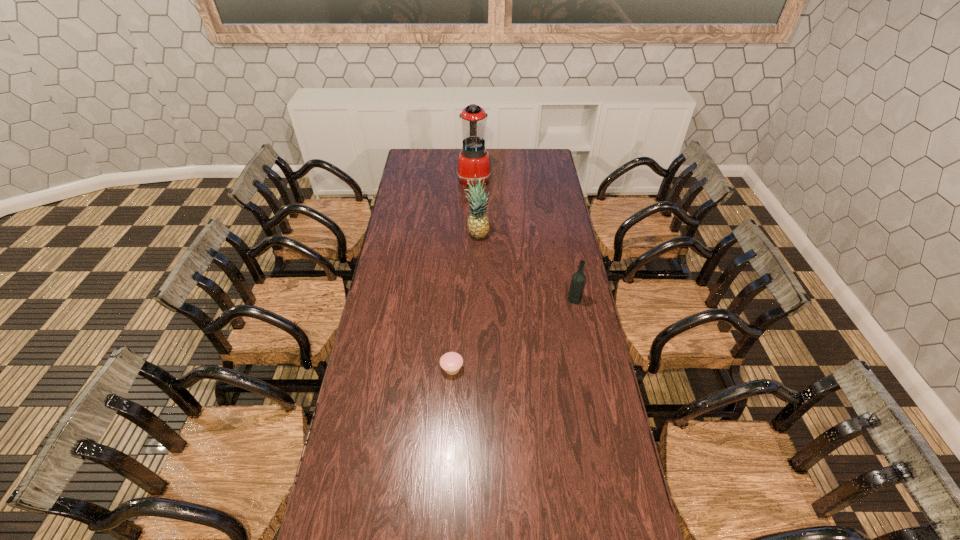
In order to click on vacant space that's between the shortest object and the tallest object in this screenshot , I will do `click(463, 273)`.

Where is `vacant space that's between the vodka and the cupcake`? vacant space that's between the vodka and the cupcake is located at coordinates (514, 334).

The image size is (960, 540). I want to click on object that stands as the second closest to the tallest object, so click(578, 280).

The image size is (960, 540). What are the coordinates of `object that can be found as the second closest to the shortest object` in the screenshot? It's located at (478, 224).

Identify the location of free location that satisfies the following two spatial constraints: 1. on the controls of the food processor; 2. on the back side of the rightmost object. (472, 299).

Locate an element on the screen. vacant region that satisfies the following two spatial constraints: 1. on the controls of the third farthest object; 2. on the right side of the food processor is located at coordinates (472, 299).

I want to click on free location that satisfies the following two spatial constraints: 1. on the controls of the farthest object; 2. on the left side of the rightmost object, so click(472, 299).

Identify the location of vacant space that satisfies the following two spatial constraints: 1. on the back side of the vodka; 2. on the controls of the food processor. (550, 178).

Where is `free space that satisfies the following two spatial constraints: 1. on the controls of the food processor; 2. on the front side of the shortest object`? This screenshot has width=960, height=540. free space that satisfies the following two spatial constraints: 1. on the controls of the food processor; 2. on the front side of the shortest object is located at coordinates (471, 368).